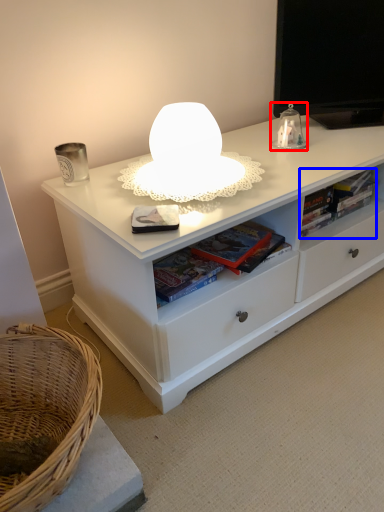
Question: Which object is closer to the camera taking this photo, table lamp (highlighted by a red box) or book (highlighted by a blue box)?

Choices:
 (A) table lamp
 (B) book

Answer: (A)